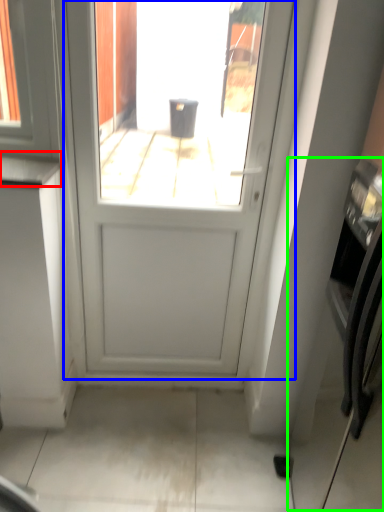
Question: Which is farther away from counter top (highlighted by a red box)? door (highlighted by a blue box) or oven (highlighted by a green box)?

Choices:
 (A) door
 (B) oven

Answer: (B)